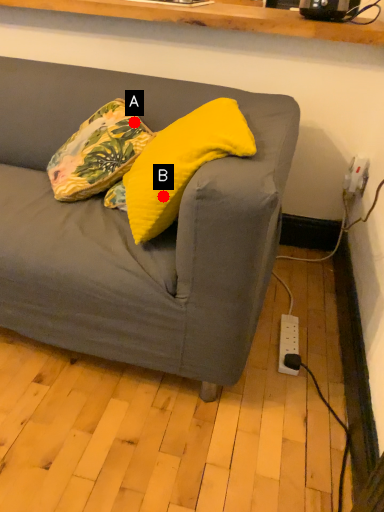
Question: Two points are circled on the image, labeled by A and B beside each circle. Which point is closer to the camera?

Choices:
 (A) A is closer
 (B) B is closer

Answer: (B)